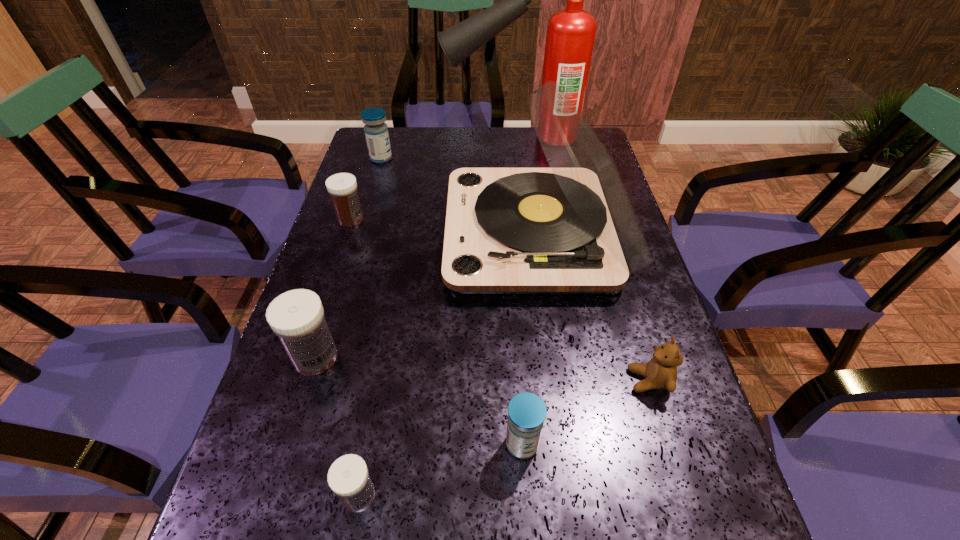
The image size is (960, 540). I want to click on empty space that is in between the teddy bear and the second nearest white medicine, so tap(482, 369).

Find the location of `empty space between the seventh shortest object and the shortest object`. empty space between the seventh shortest object and the shortest object is located at coordinates (447, 364).

You are a GUI agent. You are given a task and a screenshot of the screen. Output one action in this format:
    pyautogui.click(x=<x>, y=<y>)
    Task: Click on the vacant space that's between the fifth object from right to left and the third farthest medicine
    
    Given the screenshot: What is the action you would take?
    click(x=337, y=426)

You are a GUI agent. You are given a task and a screenshot of the screen. Output one action in this format:
    pyautogui.click(x=<x>, y=<y>)
    Task: Click on the free point between the teddy bear and the rightmost medicine
    
    Given the screenshot: What is the action you would take?
    pyautogui.click(x=586, y=412)

I want to click on free space between the seventh nearest object and the nearer blue medicine, so [x=451, y=301].

The image size is (960, 540). I want to click on object that stands as the fourth closest to the fifth object from right to left, so click(660, 372).

Select which object appears as the sixth closest to the rightmost medicine. Please provide its 2D coordinates. Your answer should be formatted as a tuple, i.e. [(x, y)], where the tuple contains the x and y coordinates of a point satisfying the conditions above.

[(376, 131)]

Identify the location of the fourth closest medicine to the teddy bear. (342, 187).

What are the coordinates of `medicine that is the nearest to the fourth farthest medicine` in the screenshot? It's located at (348, 477).

Locate an element on the screen. The width and height of the screenshot is (960, 540). blue medicine that can be found as the closest to the teddy bear is located at coordinates pyautogui.click(x=526, y=411).